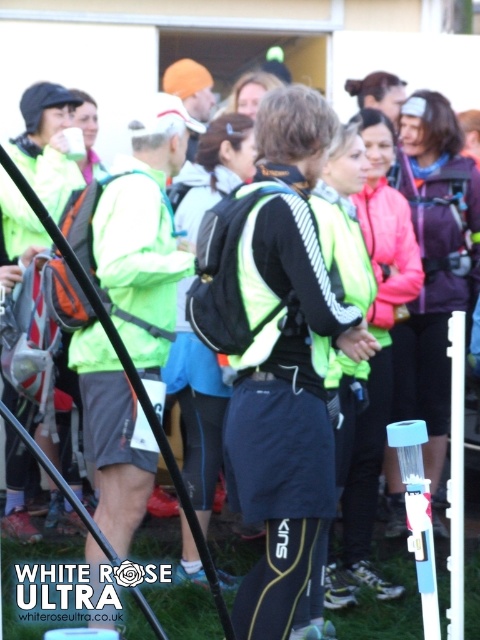
Is purple fleece vest at center above blue plastic water bottle at center?

Indeed, purple fleece vest at center is positioned over blue plastic water bottle at center.

Is purple fleece vest at center wider than blue plastic water bottle at center?

Yes, purple fleece vest at center is wider than blue plastic water bottle at center.

Locate an element on the screen. purple fleece vest at center is located at coordinates (444, 230).

Which is more to the left, neon green reflective safety vest at center or blue plastic water bottle at center?

neon green reflective safety vest at center is more to the left.

Is point (269, 252) farther from camera compared to point (417, 428)?

That is True.

Between point (323, 339) and point (406, 470), which one is positioned behind?

The point (323, 339) is behind.

Where is `neon green reflective safety vest at center`? neon green reflective safety vest at center is located at coordinates (262, 282).

Which is above, green matte jacket at center or purple fleece vest at center?

purple fleece vest at center is higher up.

Locate an element on the screen. This screenshot has height=640, width=480. green matte jacket at center is located at coordinates (144, 234).

Locate an element on the screen. This screenshot has width=480, height=640. green matte jacket at center is located at coordinates (144, 234).